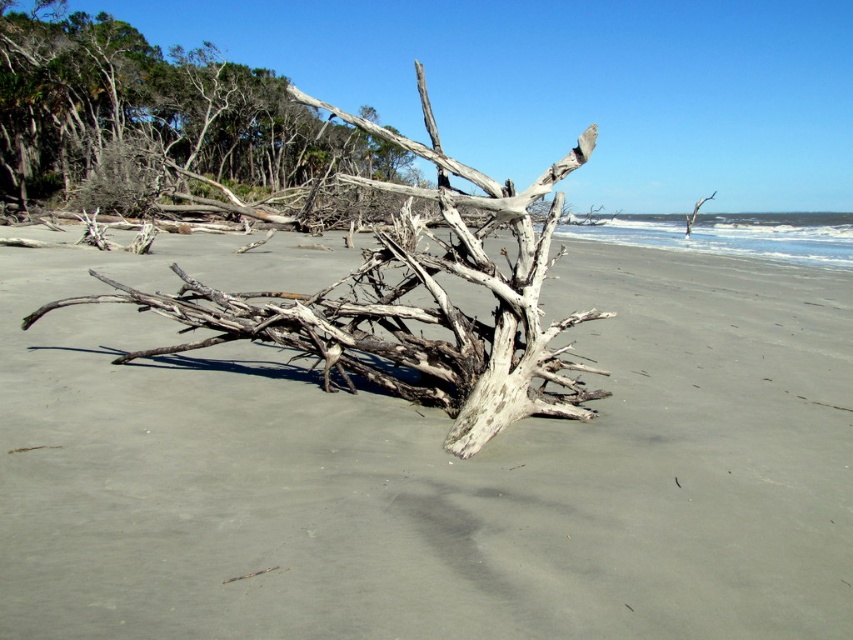
You are standing on the beach and want to walk from the driftwood to the dense line of trees in the background. Which point, point (637,436) or point (234,182), is closer to you as you start your journey?

Point (637,436) is closer to the viewer than point (234,182), so you should start walking towards point (637,436) first.